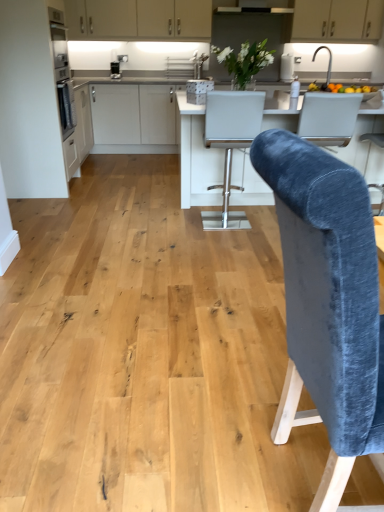
The height and width of the screenshot is (512, 384). Identify the location of free space behind velvet blue chair at center, which appears as the 2th chair when viewed from the back. (241, 377).